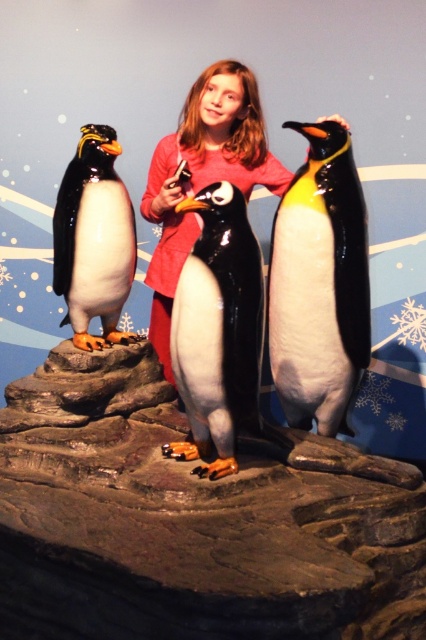
Can you confirm if glossy black penguin at right is wider than shiny black penguin at left?

Correct, the width of glossy black penguin at right exceeds that of shiny black penguin at left.

This screenshot has height=640, width=426. What are the coordinates of `glossy black penguin at right` in the screenshot? It's located at (319, 284).

Looking at this image, is smooth gray rock at center positioned behind glossy black penguin at right?

No, smooth gray rock at center is in front of glossy black penguin at right.

Between point (238, 552) and point (339, 388), which one is positioned behind?

The point (339, 388) is more distant.

Locate an element on the screen. This screenshot has width=426, height=640. smooth gray rock at center is located at coordinates (192, 522).

Between point (379, 589) and point (160, 308), which one is positioned behind?

The point (160, 308) is behind.

Who is taller, smooth gray rock at center or matte pink shirt at center?

With more height is matte pink shirt at center.

Is point (155, 467) positioned behind point (186, 236)?

That is False.

Where is `smooth gray rock at center`? Image resolution: width=426 pixels, height=640 pixels. smooth gray rock at center is located at coordinates (192, 522).